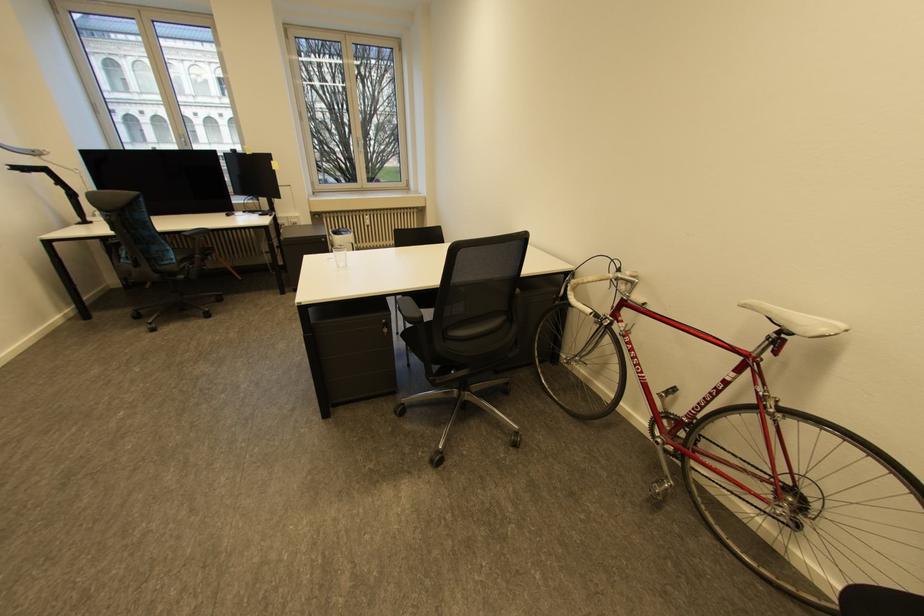
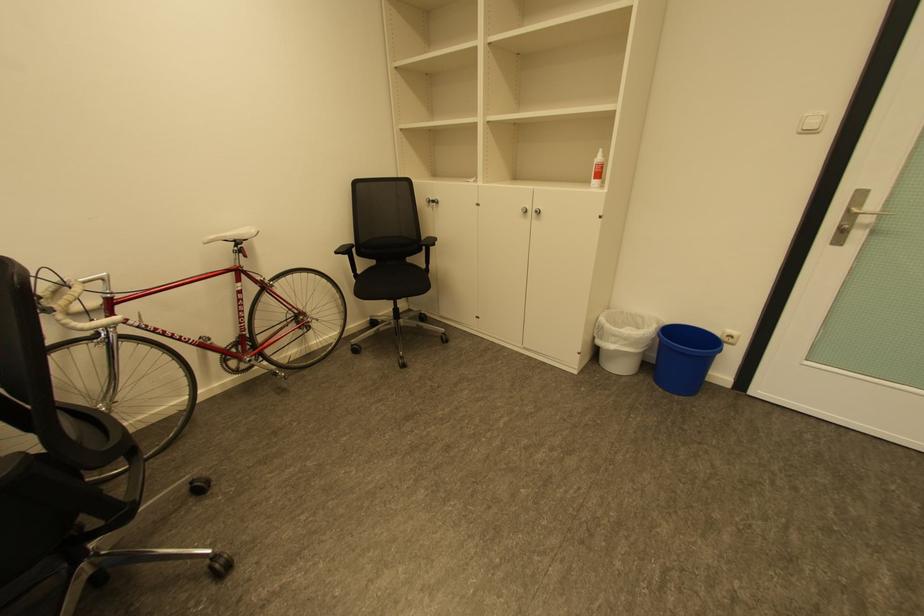
In the second image, find the point that corresponds to point (785, 326) in the first image.

(241, 241)